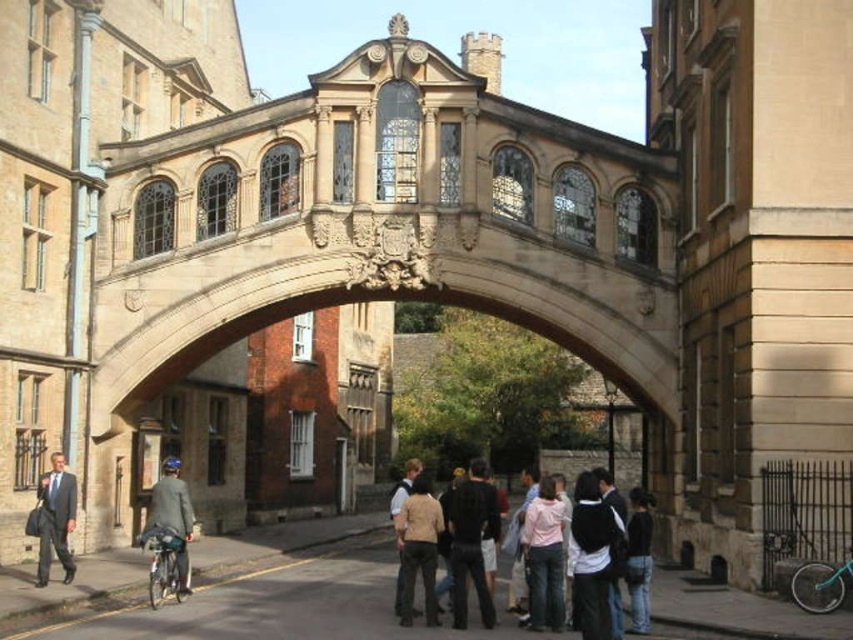
Question: Does matte gray suit at lower left appear on the left side of tan leather jacket at center?

Choices:
 (A) no
 (B) yes

Answer: (B)

Question: Estimate the real-world distances between objects in this image. Which object is farther from the tan fabric jacket at center?

Choices:
 (A) beige stone bridge at center
 (B) tan leather jacket at center
 (C) matte black suit at left

Answer: (A)

Question: Is beige stone bridge at center bigger than tan leather jacket at center?

Choices:
 (A) no
 (B) yes

Answer: (B)

Question: Among these points, which one is nearest to the camera?

Choices:
 (A) (322, 230)
 (B) (70, 561)
 (C) (407, 515)
 (D) (161, 500)

Answer: (C)

Question: Is light brown leather jacket at lower center positioned at the back of matte gray suit at lower left?

Choices:
 (A) no
 (B) yes

Answer: (A)

Question: Among these objects, which one is nearest to the camera?

Choices:
 (A) matte gray suit at lower left
 (B) tan fabric jacket at center
 (C) matte black suit at left

Answer: (B)